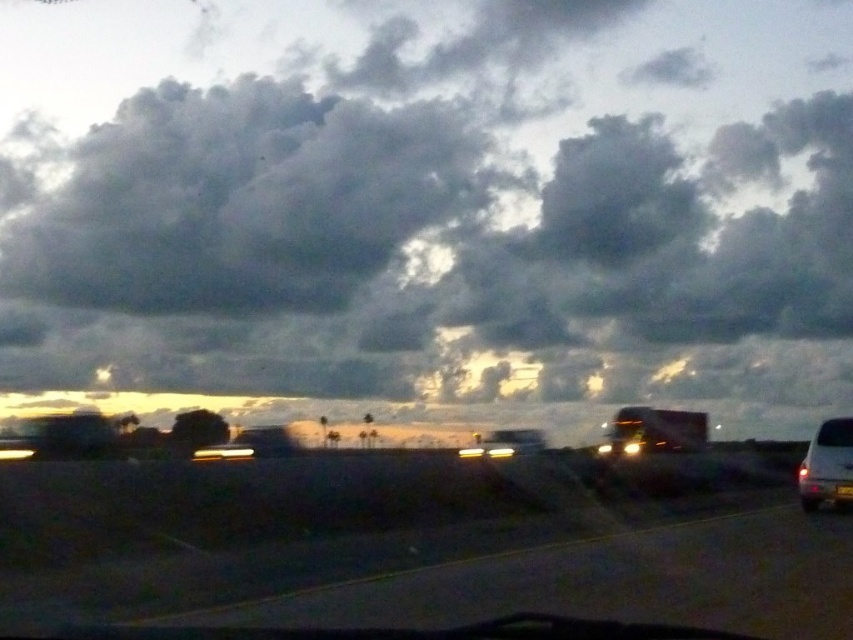
Who is positioned more to the left, dark gray cloud at upper center or transparent glass windshield at lower right?

dark gray cloud at upper center

Between dark gray cloud at upper center and transparent glass windshield at lower right, which one has less height?

transparent glass windshield at lower right

Which is behind, point (456, 218) or point (825, 436)?

Point (456, 218)

Locate an element on the screen. dark gray cloud at upper center is located at coordinates (427, 198).

Between dark gray cloud at upper center and white glossy van at lower right, which one appears on the left side from the viewer's perspective?

Positioned to the left is dark gray cloud at upper center.

Does dark gray cloud at upper center have a greater width compared to white glossy van at lower right?

Indeed, dark gray cloud at upper center has a greater width compared to white glossy van at lower right.

Does point (303, 17) come farther from viewer compared to point (828, 426)?

Yes.

Locate an element on the screen. The height and width of the screenshot is (640, 853). dark gray cloud at upper center is located at coordinates (x=427, y=198).

Between white glossy van at lower right and transparent glass windshield at lower right, which one is positioned lower?

white glossy van at lower right is lower down.

Locate an element on the screen. white glossy van at lower right is located at coordinates (827, 465).